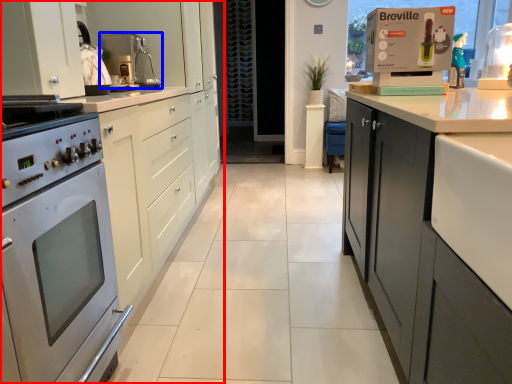
Question: Which object appears closest to the camera in this image, cabinetry (highlighted by a red box) or kitchen appliance (highlighted by a blue box)?

Choices:
 (A) cabinetry
 (B) kitchen appliance

Answer: (A)